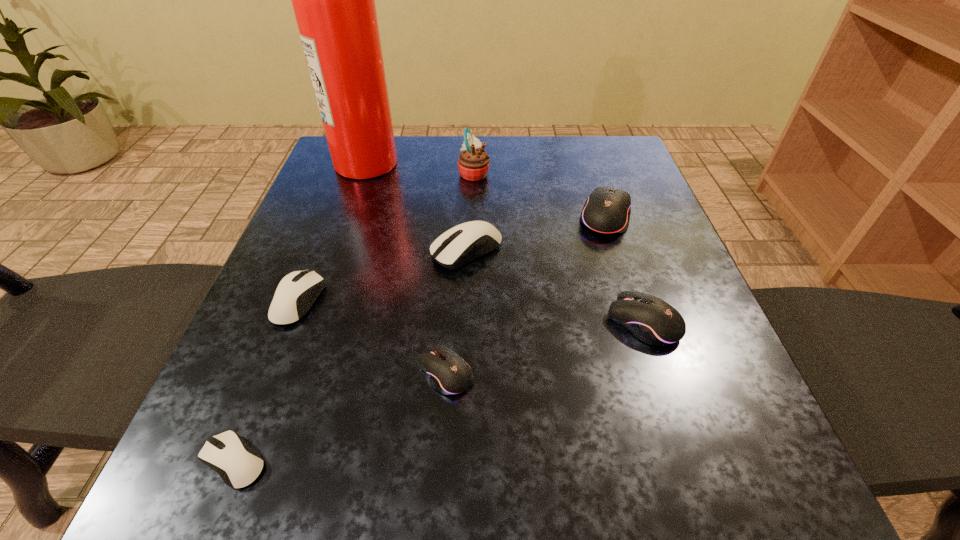
Where is `fire extinguisher located in the far edge section of the desktop`? fire extinguisher located in the far edge section of the desktop is located at coordinates (333, 0).

Where is `muffin that is at the far edge`? muffin that is at the far edge is located at coordinates (473, 163).

This screenshot has height=540, width=960. In order to click on object present at the near edge in this screenshot , I will do `click(238, 464)`.

Identify the location of fire extinguisher present at the left edge. The image size is (960, 540). (333, 0).

The image size is (960, 540). I want to click on object that is at the far left corner, so click(x=333, y=0).

In order to click on object positioned at the near left corner in this screenshot , I will do `click(238, 464)`.

Where is `vacant area at the far edge of the desktop`? Image resolution: width=960 pixels, height=540 pixels. vacant area at the far edge of the desktop is located at coordinates (457, 147).

Identify the location of vacant space at the near edge of the desktop. (563, 498).

I want to click on free space at the left edge, so (223, 407).

What are the coordinates of `vacant space at the right edge` in the screenshot? It's located at (668, 351).